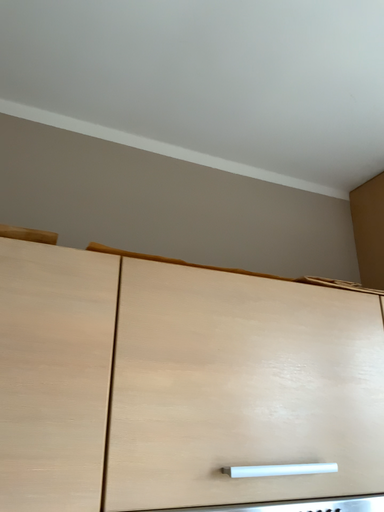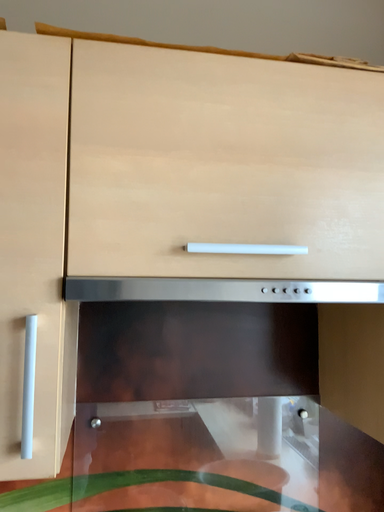
Question: How did the camera likely rotate when shooting the video?

Choices:
 (A) rotated right
 (B) rotated left

Answer: (B)